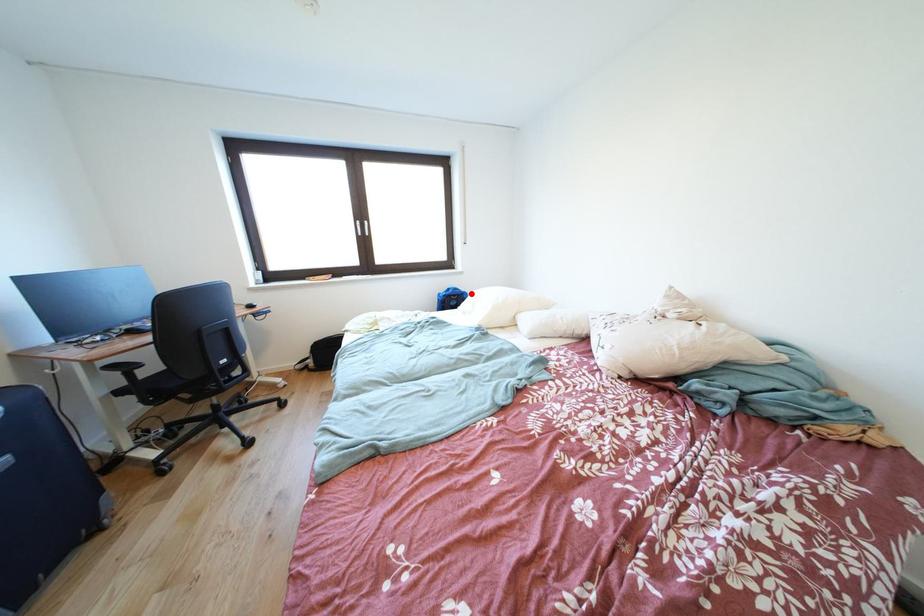
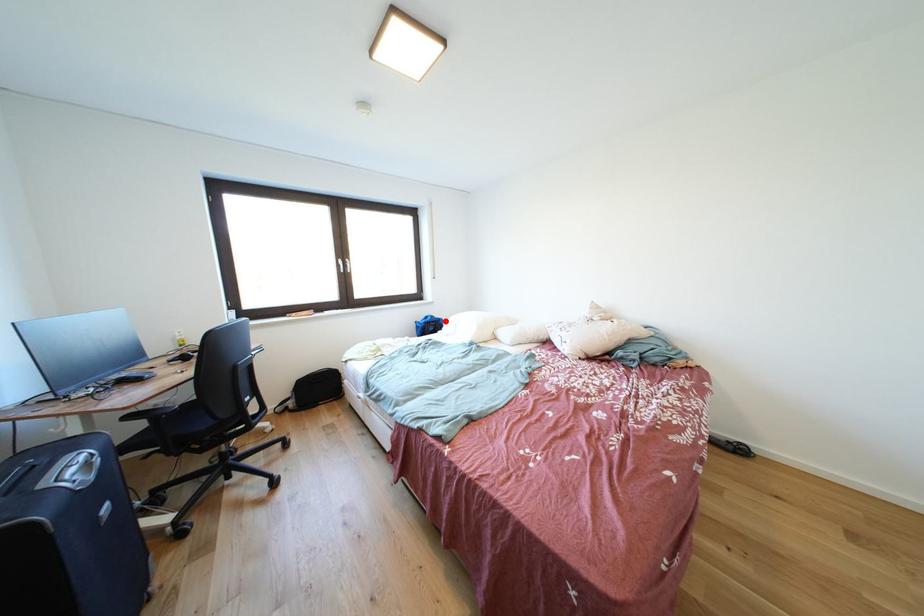
I am providing you with two images of the same scene from different viewpoints. A red point is marked on the first image and another point is marked on the second image. Do the highlighted points in image1 and image2 indicate the same real-world spot?

Yes